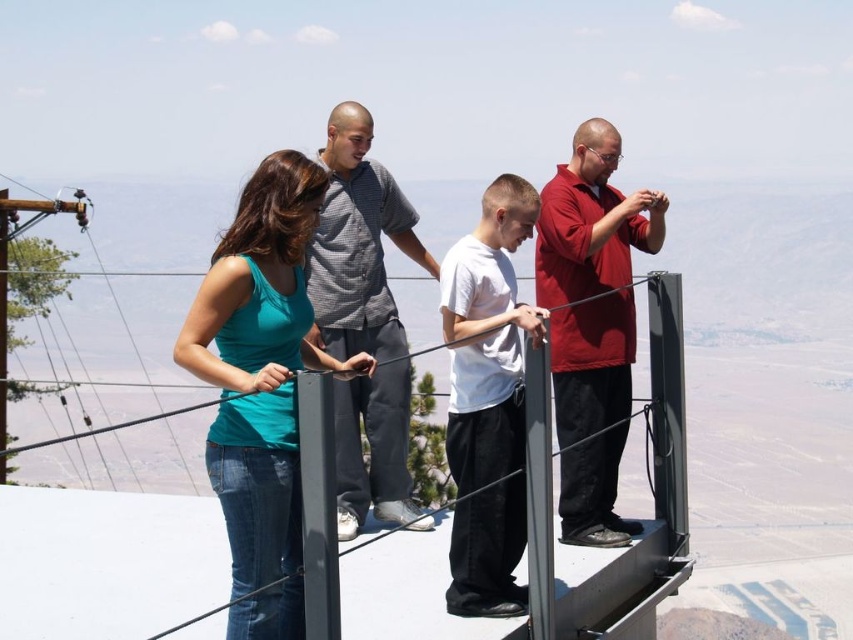
Question: Among these points, which one is nearest to the camera?

Choices:
 (A) (465, 356)
 (B) (236, 595)
 (C) (552, 282)

Answer: (B)

Question: Does white matte shirt at center appear on the left side of gray checkered shirt at center?

Choices:
 (A) yes
 (B) no

Answer: (B)

Question: Which point appears closest to the camera in this image?

Choices:
 (A) pyautogui.click(x=474, y=541)
 (B) pyautogui.click(x=281, y=433)
 (C) pyautogui.click(x=608, y=346)

Answer: (B)

Question: Considering the relative positions of teal matte tank top at center and white matte shirt at center in the image provided, where is teal matte tank top at center located with respect to white matte shirt at center?

Choices:
 (A) right
 (B) left

Answer: (B)

Question: Which of the following is the farthest from the observer?

Choices:
 (A) gray checkered shirt at center
 (B) white matte shirt at center
 (C) matte red shirt at right

Answer: (C)

Question: Where is matte red shirt at right located in relation to gray checkered shirt at center in the image?

Choices:
 (A) below
 (B) above

Answer: (B)